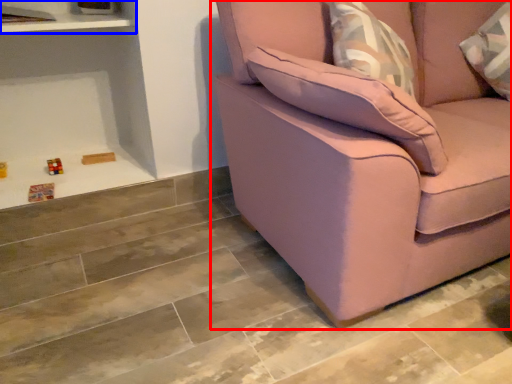
Question: Which point is further to the camera, studio couch (highlighted by a red box) or shelf (highlighted by a blue box)?

Choices:
 (A) studio couch
 (B) shelf

Answer: (B)